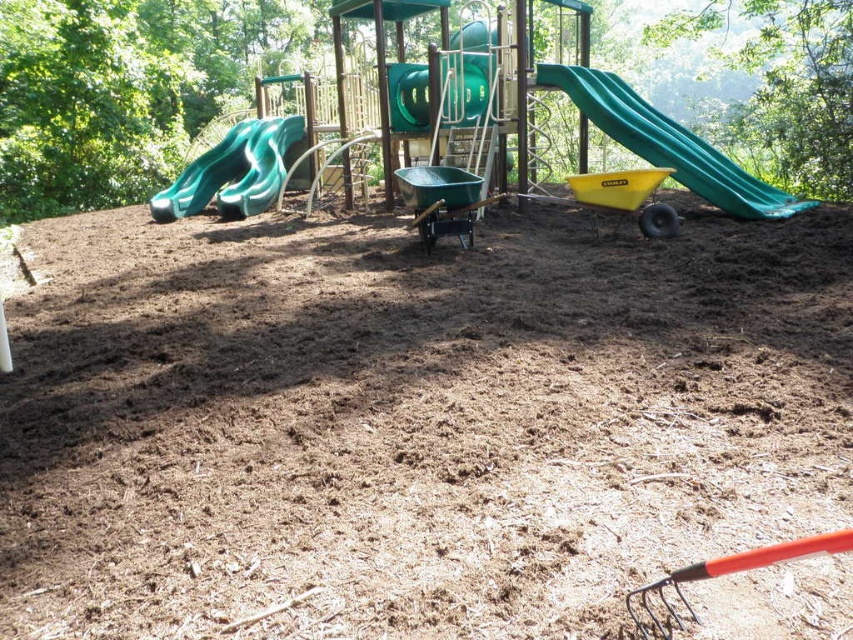
Does brown mulch at center appear on the left side of green rubber slide at left?

No, brown mulch at center is not to the left of green rubber slide at left.

Can you confirm if brown mulch at center is wider than green rubber slide at left?

Incorrect, brown mulch at center's width does not surpass green rubber slide at left's.

This screenshot has width=853, height=640. What do you see at coordinates (409, 420) in the screenshot?
I see `brown mulch at center` at bounding box center [409, 420].

Locate an element on the screen. This screenshot has width=853, height=640. brown mulch at center is located at coordinates (409, 420).

Is the position of green plastic slide at right less distant than that of green rubber slide at left?

Yes, green plastic slide at right is in front of green rubber slide at left.

Does green plastic slide at right have a lesser width compared to green rubber slide at left?

Incorrect, green plastic slide at right's width is not less than green rubber slide at left's.

Describe the element at coordinates (666, 144) in the screenshot. I see `green plastic slide at right` at that location.

Image resolution: width=853 pixels, height=640 pixels. What are the coordinates of `green plastic slide at right` in the screenshot? It's located at (666, 144).

Is brown mulch at center closer to camera compared to green plastic slide at right?

That is True.

Who is more distant from viewer, (773,522) or (635,99)?

The point (635,99) is behind.

Where is `brown mulch at center`? The width and height of the screenshot is (853, 640). brown mulch at center is located at coordinates (409, 420).